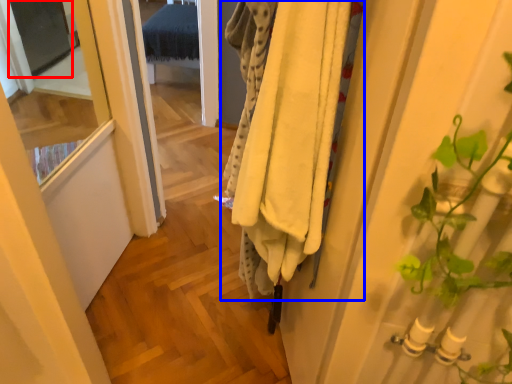
Question: Which of the following is the farthest to the observer, screen door (highlighted by a red box) or clothing (highlighted by a blue box)?

Choices:
 (A) screen door
 (B) clothing

Answer: (A)